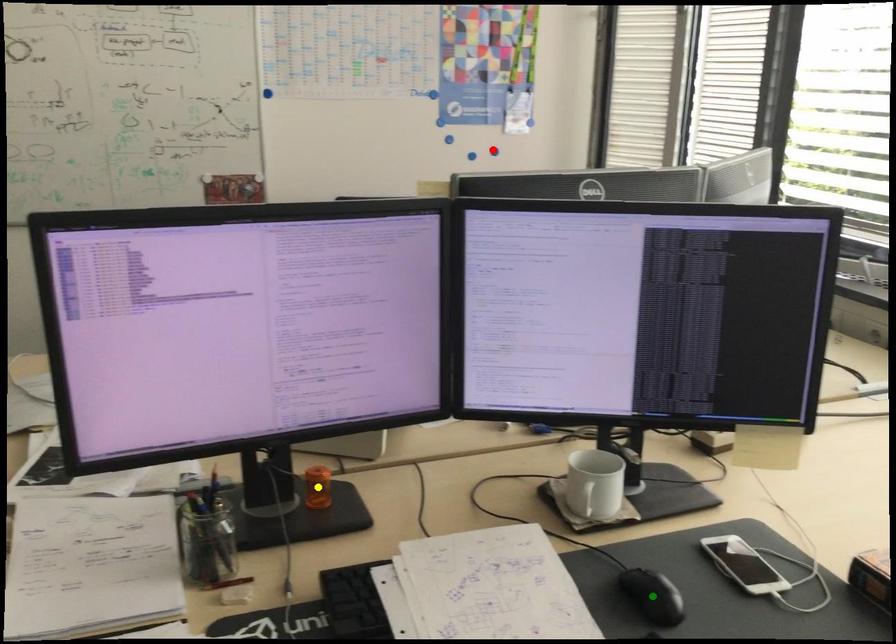
Order these from nearest to farthest:
- yellow point
- red point
- green point

green point < yellow point < red point